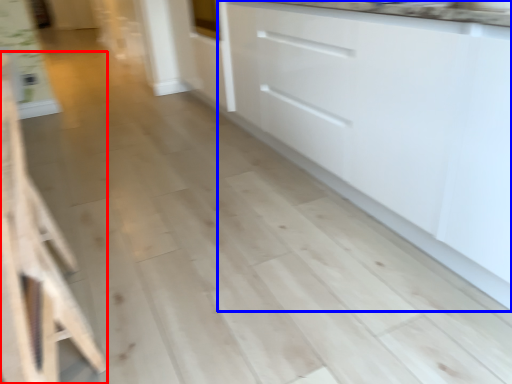
Question: Among these objects, which one is farthest to the camera, furniture (highlighted by a red box) or cabinetry (highlighted by a blue box)?

Choices:
 (A) furniture
 (B) cabinetry

Answer: (B)